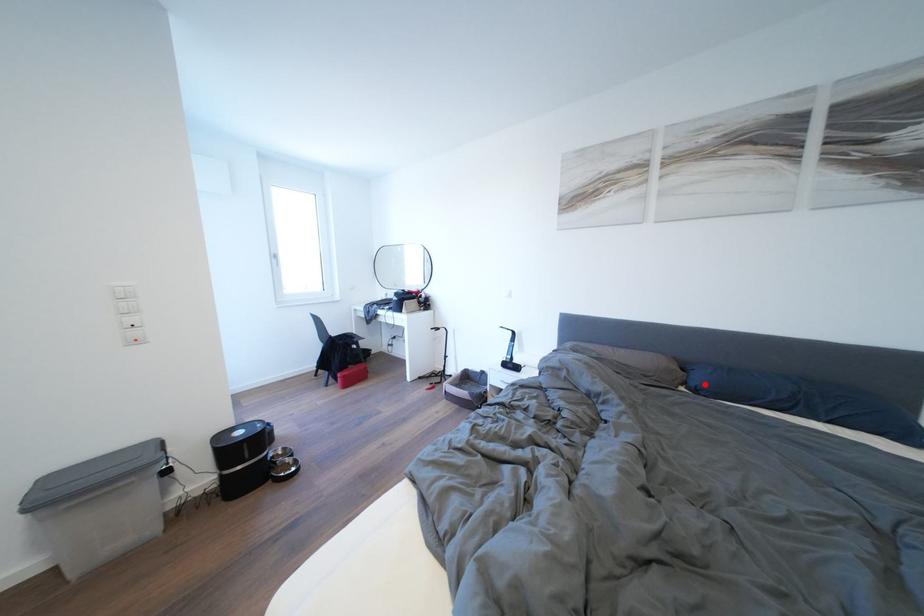
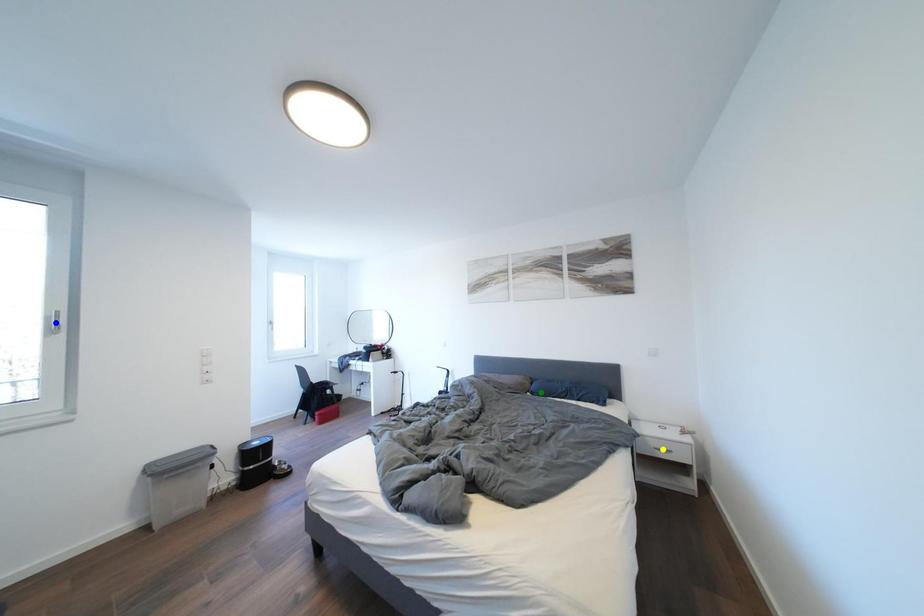
Question: I am providing you with two images of the same scene from different viewpoints. A red point is marked on the first image. You are given multiple points on the second image. Which mark in image 2 goes with the point in image 1?

Choices:
 (A) yellow point
 (B) green point
 (C) blue point

Answer: (B)